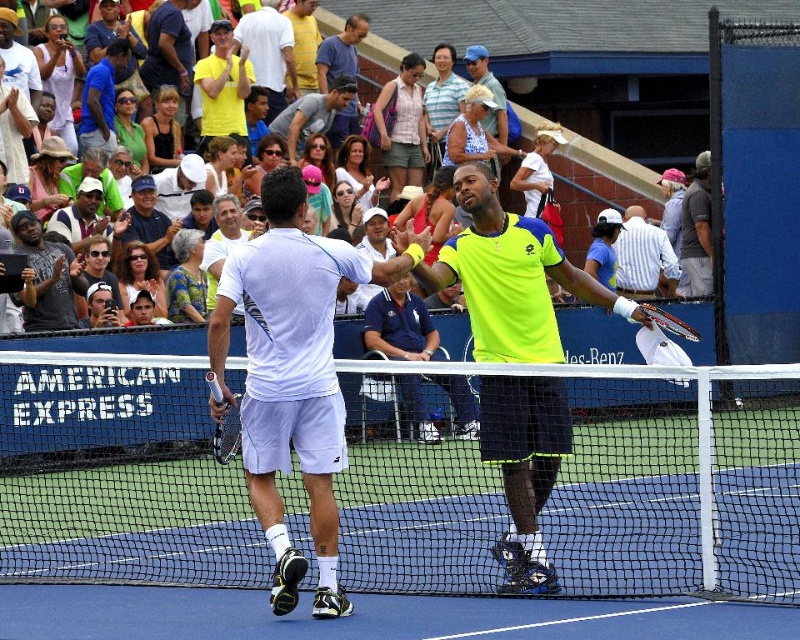
Who is positioned more to the left, white matte shorts at center or neon yellow fabric shirt at center?

Positioned to the left is white matte shorts at center.

Between point (290, 403) and point (556, 472), which one is positioned in front?

Point (290, 403) is in front.

Is point (252, 305) positioned behind point (516, 563)?

That is False.

You are a GUI agent. You are given a task and a screenshot of the screen. Output one action in this format:
    pyautogui.click(x=<x>, y=<y>)
    Task: Click on the white matte shorts at center
    
    Given the screenshot: What is the action you would take?
    pyautogui.click(x=293, y=374)

Does neon yellow shirt at center have a larger size compared to neon yellow shirt at upper right?

Yes.

Is point (374, 296) positioned behind point (702, 278)?

No, (374, 296) is closer to viewer.

What are the coordinates of `neon yellow shirt at center` in the screenshot? It's located at (400, 324).

In the scene shown: Does multicolored casual clothing at upper center come in front of matte black jacket at left?

No, it is not.

Is point (586, 180) farther from viewer compared to point (68, 248)?

Yes, point (586, 180) is farther from viewer.

Where is `multicolored casual clothing at upper center`? This screenshot has height=640, width=800. multicolored casual clothing at upper center is located at coordinates (609, 172).